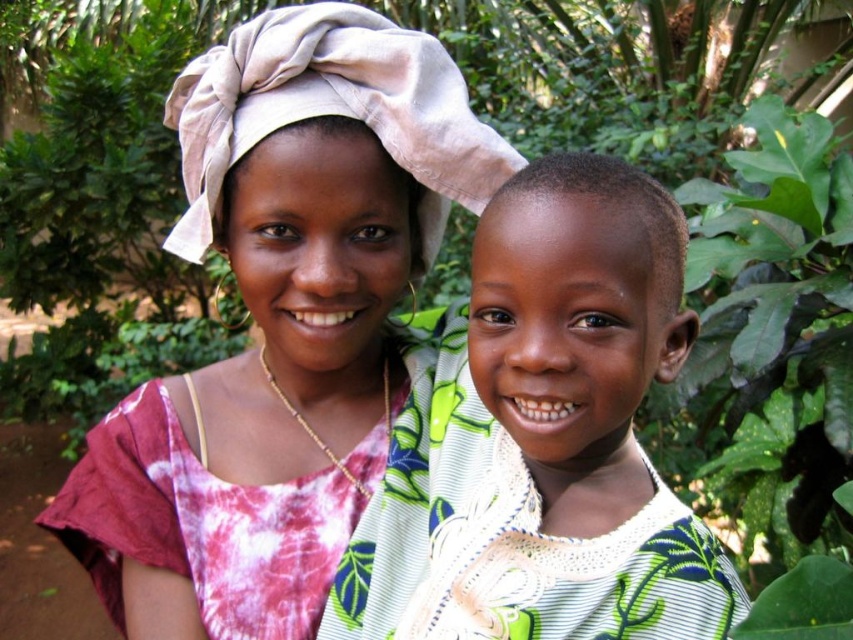
Question: Does matte tie-dye blouse at center lie behind green leafy fabric at center?

Choices:
 (A) no
 (B) yes

Answer: (B)

Question: Does green leafy fabric at center have a lesser width compared to smooth skin head at center?

Choices:
 (A) yes
 (B) no

Answer: (B)

Question: Which of the following is the closest to the observer?

Choices:
 (A) (639, 508)
 (B) (503, 316)

Answer: (B)

Question: Which point is closer to the camera taking this photo?

Choices:
 (A) (634, 179)
 (B) (136, 520)
 (C) (601, 225)

Answer: (C)

Question: Which object appears farthest from the camera in this image?

Choices:
 (A) smooth skin head at center
 (B) green leafy fabric at center

Answer: (B)

Question: Where is green leafy fabric at center located in relation to smooth skin head at center in the image?

Choices:
 (A) above
 (B) below

Answer: (B)